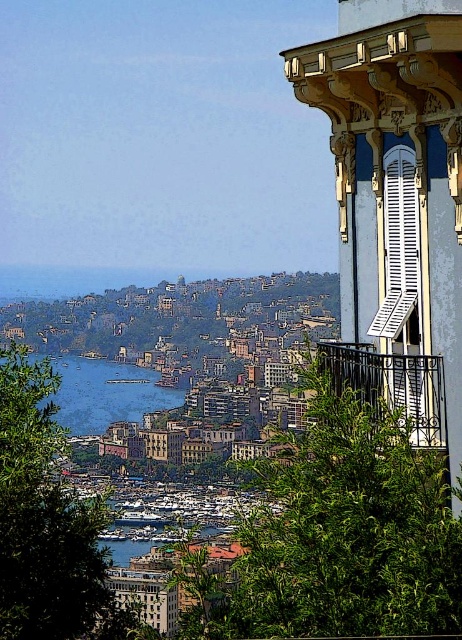
You are standing on a balcony and notice two elements in the scene. The first is a green leafy tree at lower left, and the second is a white matte shutter at upper right. Which of these two elements is positioned more to the left side of the scene?

The green leafy tree at lower left is positioned to the left of the white matte shutter at upper right, so the green leafy tree at lower left is more to the left side of the scene.

You are standing at the center of the image and want to take a photo of the green leafy tree at center. Which direction should you move to get the tree in the center of your camera frame?

Since the green leafy tree at center is already at the center of the image, you don not need to move. The tree is already in the center of the camera frame.